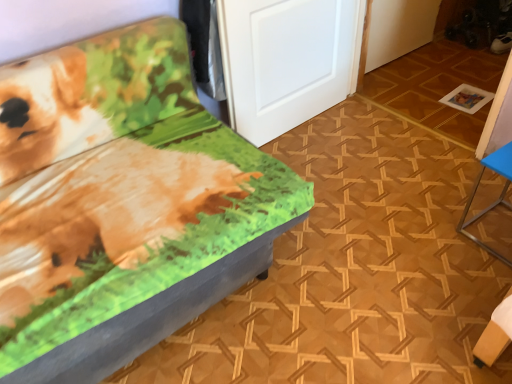
Question: Can you confirm if blue metallic table at right, which is the first furniture in right-to-left order, is thinner than printed fabric bench at left, which is the 2th furniture in right-to-left order?

Choices:
 (A) no
 (B) yes

Answer: (B)

Question: From a real-world perspective, is blue metallic table at right, which is the first furniture in right-to-left order, physically above printed fabric bench at left, which is the 2th furniture in right-to-left order?

Choices:
 (A) yes
 (B) no

Answer: (B)

Question: Are blue metallic table at right, which is the first furniture in right-to-left order, and printed fabric bench at left, which is the 2th furniture in right-to-left order, beside each other?

Choices:
 (A) no
 (B) yes

Answer: (A)

Question: Is blue metallic table at right, which is the 2th furniture from left to right, positioned beyond the bounds of printed fabric bench at left, the first furniture from the left?

Choices:
 (A) yes
 (B) no

Answer: (A)

Question: Is blue metallic table at right, which is the 2th furniture from left to right, shorter than printed fabric bench at left, the first furniture from the left?

Choices:
 (A) no
 (B) yes

Answer: (B)

Question: Is white matte door at center in front of or behind printed fabric bench at left, the first furniture from the left, in the image?

Choices:
 (A) front
 (B) behind

Answer: (B)

Question: From the image's perspective, is white matte door at center located above or below printed fabric bench at left, which is the 2th furniture in right-to-left order?

Choices:
 (A) above
 (B) below

Answer: (A)

Question: Which is correct: white matte door at center is inside printed fabric bench at left, which is the 2th furniture in right-to-left order, or outside of it?

Choices:
 (A) inside
 (B) outside

Answer: (B)

Question: Is white matte door at center bigger or smaller than printed fabric bench at left, the first furniture from the left?

Choices:
 (A) small
 (B) big

Answer: (A)

Question: In terms of size, does printed fabric bench at left, which is the 2th furniture in right-to-left order, appear bigger or smaller than white matte door at center?

Choices:
 (A) small
 (B) big

Answer: (B)

Question: From a real-world perspective, is printed fabric bench at left, the first furniture from the left, physically located above or below white matte door at center?

Choices:
 (A) above
 (B) below

Answer: (B)

Question: Relative to white matte door at center, is printed fabric bench at left, which is the 2th furniture in right-to-left order, in front or behind?

Choices:
 (A) front
 (B) behind

Answer: (A)

Question: Considering the relative positions of printed fabric bench at left, the first furniture from the left, and white matte door at center in the image provided, is printed fabric bench at left, the first furniture from the left, to the left or to the right of white matte door at center?

Choices:
 (A) right
 (B) left

Answer: (B)

Question: Does point (505, 205) appear closer or farther from the camera than point (204, 168)?

Choices:
 (A) farther
 (B) closer

Answer: (A)

Question: Looking at the image, does blue metallic table at right, which is the 2th furniture from left to right, seem bigger or smaller compared to printed fabric bench at left, the first furniture from the left?

Choices:
 (A) small
 (B) big

Answer: (A)